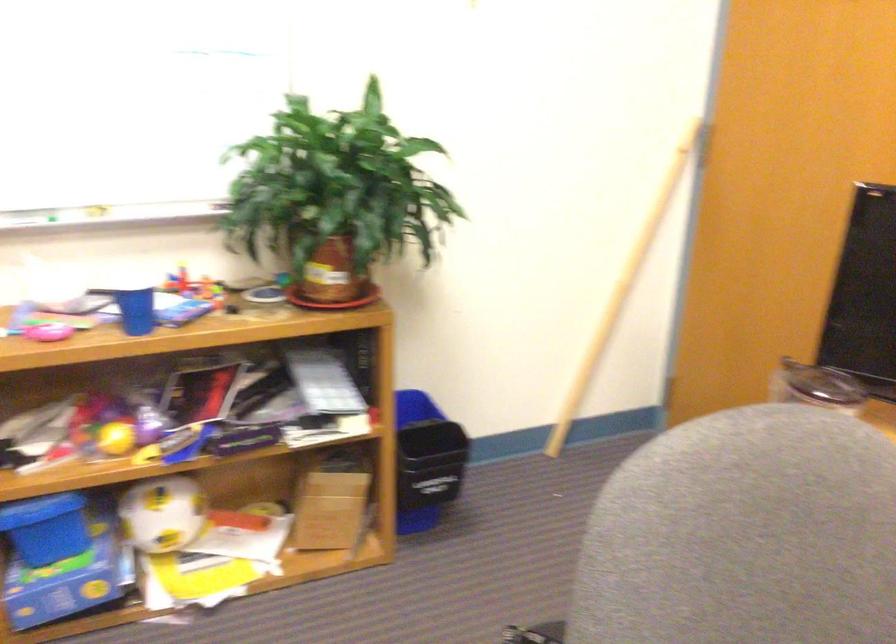
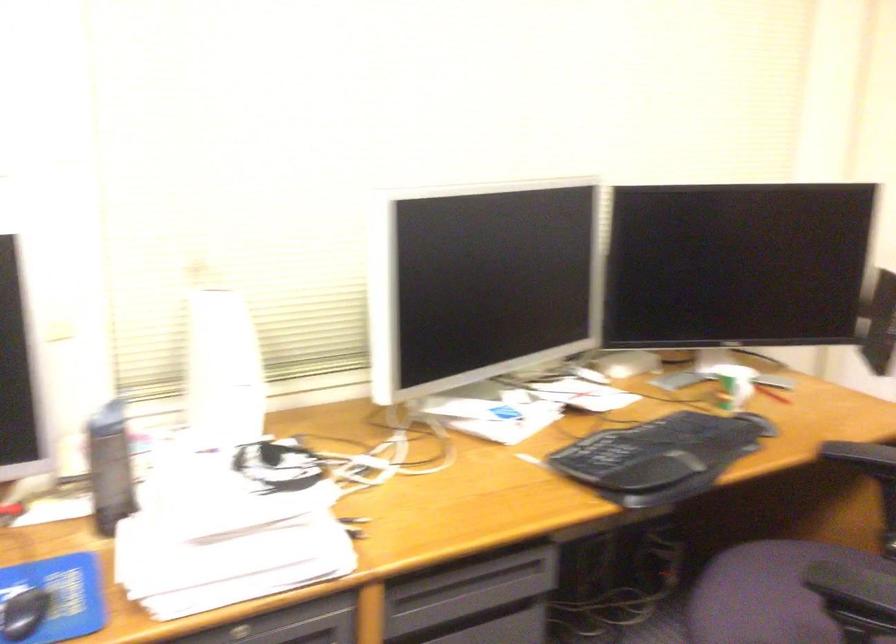
Question: The camera is either moving clockwise (left) or counter-clockwise (right) around the object. The first image is from the beginning of the video and the second image is from the end. Is the camera moving left or right when shooting the video?

Choices:
 (A) Left
 (B) Right

Answer: (B)